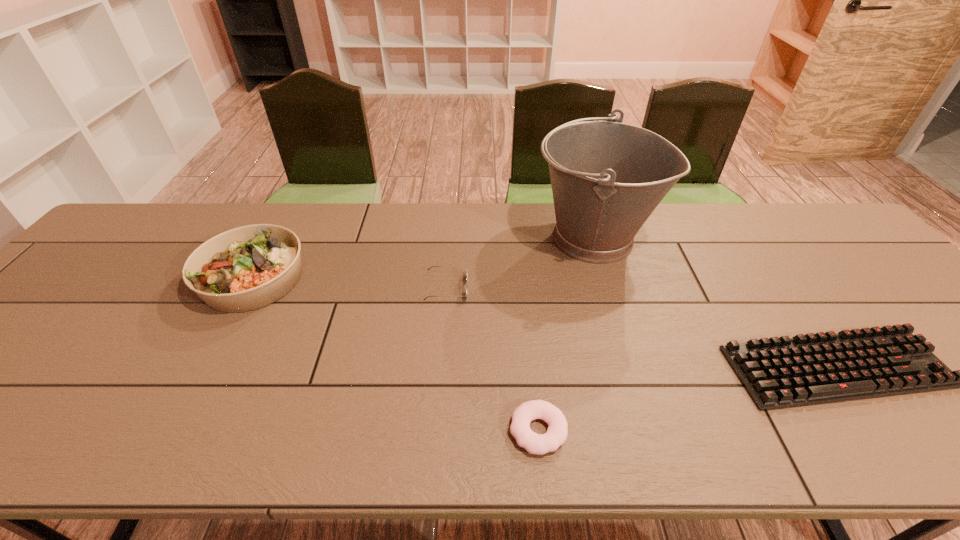
Image resolution: width=960 pixels, height=540 pixels. Identify the location of bucket. pos(607,177).

You are a GUI agent. You are given a task and a screenshot of the screen. Output one action in this format:
    pyautogui.click(x=<x>, y=<y>)
    Task: Click on the second tallest object
    The image size is (960, 540).
    Given the screenshot: What is the action you would take?
    pyautogui.click(x=249, y=267)

At what (x,y) coordinates should I click in order to perform the action: click on the leftmost object. Please return your answer as a coordinate pair (x, y). Looking at the image, I should click on (249, 267).

Locate an element on the screen. The height and width of the screenshot is (540, 960). the second object from left to right is located at coordinates (433, 266).

Identify the location of the third shortest object. (433, 266).

Identify the location of doughnut. (557, 432).

At what (x,y) coordinates should I click in order to perform the action: click on vacant space situated on the right of the tallest object. Please return your answer as a coordinate pair (x, y). The width and height of the screenshot is (960, 540). Looking at the image, I should click on (707, 238).

Locate an element on the screen. The height and width of the screenshot is (540, 960). blank area located on the right of the leftmost object is located at coordinates (391, 278).

Identify the location of vacant space located on the front-facing side of the third shortest object. The height and width of the screenshot is (540, 960). (614, 287).

Locate an element on the screen. The height and width of the screenshot is (540, 960). vacant area located 0.240m on the left of the doughnut is located at coordinates (388, 430).